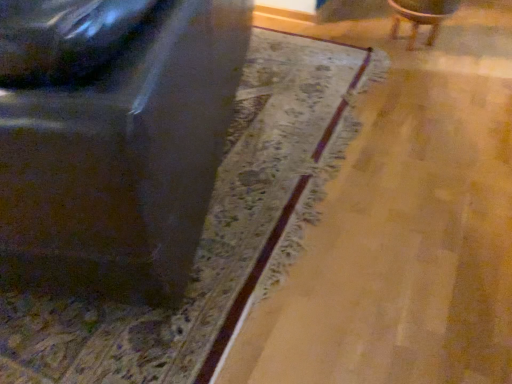
What do you see at coordinates (421, 16) in the screenshot?
I see `wooden chair at upper right, acting as the 2th chair starting from the left` at bounding box center [421, 16].

Looking at this image, measure the distance between wooden chair at upper right, acting as the 2th chair starting from the left, and camera.

The depth of wooden chair at upper right, acting as the 2th chair starting from the left, is 2.10 meters.

Identify the location of wooden chair at upper right, the first chair in the right-to-left sequence. (421, 16).

Image resolution: width=512 pixels, height=384 pixels. What do you see at coordinates (123, 159) in the screenshot? I see `metallic silver chair at left, which is the second chair in right-to-left order` at bounding box center [123, 159].

The height and width of the screenshot is (384, 512). I want to click on metallic silver chair at left, which is counted as the 1th chair, starting from the left, so click(123, 159).

In order to click on wooden chair at upper right, the first chair in the right-to-left sequence in this screenshot , I will do `click(421, 16)`.

Which is more to the left, metallic silver chair at left, which is the second chair in right-to-left order, or wooden chair at upper right, acting as the 2th chair starting from the left?

metallic silver chair at left, which is the second chair in right-to-left order.

Which object is further away from the camera taking this photo, metallic silver chair at left, which is counted as the 1th chair, starting from the left, or wooden chair at upper right, the first chair in the right-to-left sequence?

Positioned behind is wooden chair at upper right, the first chair in the right-to-left sequence.

Between point (240, 9) and point (417, 4), which one is positioned in front?

The point (240, 9) is closer to the camera.

Based on the photo, from the image's perspective, does metallic silver chair at left, which is the second chair in right-to-left order, appear higher than wooden chair at upper right, the first chair in the right-to-left sequence?

Actually, metallic silver chair at left, which is the second chair in right-to-left order, appears below wooden chair at upper right, the first chair in the right-to-left sequence, in the image.

From a real-world perspective, which is physically below, metallic silver chair at left, which is the second chair in right-to-left order, or wooden chair at upper right, the first chair in the right-to-left sequence?

wooden chair at upper right, the first chair in the right-to-left sequence.

Which object is wider, metallic silver chair at left, which is counted as the 1th chair, starting from the left, or wooden chair at upper right, the first chair in the right-to-left sequence?

metallic silver chair at left, which is counted as the 1th chair, starting from the left, is wider.

Considering the sizes of objects metallic silver chair at left, which is the second chair in right-to-left order, and wooden chair at upper right, acting as the 2th chair starting from the left, in the image provided, who is shorter, metallic silver chair at left, which is the second chair in right-to-left order, or wooden chair at upper right, acting as the 2th chair starting from the left,?

wooden chair at upper right, acting as the 2th chair starting from the left.

Is metallic silver chair at left, which is the second chair in right-to-left order, bigger than wooden chair at upper right, acting as the 2th chair starting from the left?

Indeed, metallic silver chair at left, which is the second chair in right-to-left order, has a larger size compared to wooden chair at upper right, acting as the 2th chair starting from the left.

Is metallic silver chair at left, which is the second chair in right-to-left order, surrounding wooden chair at upper right, the first chair in the right-to-left sequence?

Actually, wooden chair at upper right, the first chair in the right-to-left sequence, is outside metallic silver chair at left, which is the second chair in right-to-left order.

Would you consider metallic silver chair at left, which is counted as the 1th chair, starting from the left, to be distant from wooden chair at upper right, acting as the 2th chair starting from the left?

Yes, metallic silver chair at left, which is counted as the 1th chair, starting from the left, is far from wooden chair at upper right, acting as the 2th chair starting from the left.

Could you tell me if metallic silver chair at left, which is the second chair in right-to-left order, is facing wooden chair at upper right, the first chair in the right-to-left sequence?

No, metallic silver chair at left, which is the second chair in right-to-left order, is not oriented towards wooden chair at upper right, the first chair in the right-to-left sequence.

How different are the orientations of metallic silver chair at left, which is the second chair in right-to-left order, and wooden chair at upper right, the first chair in the right-to-left sequence, in degrees?

There is a 71.3-degree angle between the facing directions of metallic silver chair at left, which is the second chair in right-to-left order, and wooden chair at upper right, the first chair in the right-to-left sequence.

In order to click on chair behind the metallic silver chair at left, which is counted as the 1th chair, starting from the left in this screenshot , I will do `click(421, 16)`.

Visually, is wooden chair at upper right, acting as the 2th chair starting from the left, positioned to the left or to the right of metallic silver chair at left, which is counted as the 1th chair, starting from the left?

wooden chair at upper right, acting as the 2th chair starting from the left, is to the right of metallic silver chair at left, which is counted as the 1th chair, starting from the left.

Is wooden chair at upper right, the first chair in the right-to-left sequence, positioned before metallic silver chair at left, which is counted as the 1th chair, starting from the left?

No.

Which is less distant, (x=437, y=22) or (x=249, y=11)?

The point (x=249, y=11) is more forward.

From the image's perspective, is wooden chair at upper right, acting as the 2th chair starting from the left, above or below metallic silver chair at left, which is counted as the 1th chair, starting from the left?

Clearly, from the image's perspective, wooden chair at upper right, acting as the 2th chair starting from the left, is above metallic silver chair at left, which is counted as the 1th chair, starting from the left.

From a real-world perspective, is wooden chair at upper right, acting as the 2th chair starting from the left, over metallic silver chair at left, which is counted as the 1th chair, starting from the left?

Incorrect, from a real-world perspective, wooden chair at upper right, acting as the 2th chair starting from the left, is lower than metallic silver chair at left, which is counted as the 1th chair, starting from the left.

In terms of width, does wooden chair at upper right, acting as the 2th chair starting from the left, look wider or thinner when compared to metallic silver chair at left, which is the second chair in right-to-left order?

Considering their sizes, wooden chair at upper right, acting as the 2th chair starting from the left, looks slimmer than metallic silver chair at left, which is the second chair in right-to-left order.

Considering the relative sizes of wooden chair at upper right, acting as the 2th chair starting from the left, and metallic silver chair at left, which is the second chair in right-to-left order, in the image provided, is wooden chair at upper right, acting as the 2th chair starting from the left, taller than metallic silver chair at left, which is the second chair in right-to-left order,?

Incorrect, the height of wooden chair at upper right, acting as the 2th chair starting from the left, is not larger of that of metallic silver chair at left, which is the second chair in right-to-left order.

Based on the photo, considering the relative sizes of wooden chair at upper right, the first chair in the right-to-left sequence, and metallic silver chair at left, which is counted as the 1th chair, starting from the left, in the image provided, is wooden chair at upper right, the first chair in the right-to-left sequence, bigger than metallic silver chair at left, which is counted as the 1th chair, starting from the left,?

No, wooden chair at upper right, the first chair in the right-to-left sequence, is not bigger than metallic silver chair at left, which is counted as the 1th chair, starting from the left.

Which is correct: wooden chair at upper right, the first chair in the right-to-left sequence, is inside metallic silver chair at left, which is the second chair in right-to-left order, or outside of it?

The correct answer is: outside.

Is wooden chair at upper right, acting as the 2th chair starting from the left, far from metallic silver chair at left, which is the second chair in right-to-left order?

That's right, there is a large distance between wooden chair at upper right, acting as the 2th chair starting from the left, and metallic silver chair at left, which is the second chair in right-to-left order.

Is wooden chair at upper right, the first chair in the right-to-left sequence, positioned with its back to metallic silver chair at left, which is the second chair in right-to-left order?

No, wooden chair at upper right, the first chair in the right-to-left sequence, is not facing away from metallic silver chair at left, which is the second chair in right-to-left order.

How different are the orientations of wooden chair at upper right, acting as the 2th chair starting from the left, and metallic silver chair at left, which is the second chair in right-to-left order, in degrees?

71.3 degrees.

Measure the distance between wooden chair at upper right, acting as the 2th chair starting from the left, and metallic silver chair at left, which is counted as the 1th chair, starting from the left.

wooden chair at upper right, acting as the 2th chair starting from the left, is 1.58 meters away from metallic silver chair at left, which is counted as the 1th chair, starting from the left.

This screenshot has width=512, height=384. I want to click on chair below the metallic silver chair at left, which is counted as the 1th chair, starting from the left (from a real-world perspective), so click(x=421, y=16).

You are a GUI agent. You are given a task and a screenshot of the screen. Output one action in this format:
    pyautogui.click(x=<x>, y=<y>)
    Task: Click on the chair below the metallic silver chair at left, which is counted as the 1th chair, starting from the left (from a real-world perspective)
    The width and height of the screenshot is (512, 384).
    Given the screenshot: What is the action you would take?
    pyautogui.click(x=421, y=16)

Locate an element on the screen. Image resolution: width=512 pixels, height=384 pixels. chair lying behind the metallic silver chair at left, which is counted as the 1th chair, starting from the left is located at coordinates (421, 16).